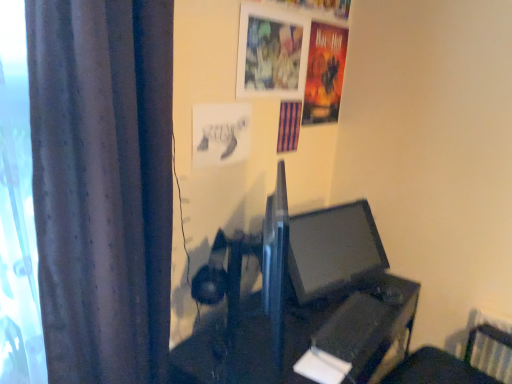
Question: Does dark grey fabric curtain at left have a smaller size compared to purple striped poster at upper center, which ranks as the 2th poster page in back-to-front order?

Choices:
 (A) yes
 (B) no

Answer: (B)

Question: Is dark grey fabric curtain at left touching purple striped poster at upper center, placed as the 2th poster page when sorted from right to left?

Choices:
 (A) yes
 (B) no

Answer: (B)

Question: Does dark grey fabric curtain at left come behind purple striped poster at upper center, marked as the second poster page in a front-to-back arrangement?

Choices:
 (A) yes
 (B) no

Answer: (B)

Question: Is dark grey fabric curtain at left not within purple striped poster at upper center, marked as the second poster page in a front-to-back arrangement?

Choices:
 (A) yes
 (B) no

Answer: (A)

Question: From a real-world perspective, is dark grey fabric curtain at left located beneath purple striped poster at upper center, marked as the second poster page in a front-to-back arrangement?

Choices:
 (A) yes
 (B) no

Answer: (A)

Question: Is point (254, 4) closer or farther from the camera than point (212, 137)?

Choices:
 (A) farther
 (B) closer

Answer: (A)

Question: Considering the positions of metallic silver picture frame at upper center and white paper at upper center, acting as the 3th poster page starting from the right, in the image, is metallic silver picture frame at upper center wider or thinner than white paper at upper center, acting as the 3th poster page starting from the right,?

Choices:
 (A) wide
 (B) thin

Answer: (A)

Question: From a real-world perspective, is metallic silver picture frame at upper center positioned above or below white paper at upper center, the first poster page positioned from the front?

Choices:
 (A) below
 (B) above

Answer: (B)

Question: Choose the correct answer: Is metallic silver picture frame at upper center inside white paper at upper center, acting as the 3th poster page starting from the right, or outside it?

Choices:
 (A) outside
 (B) inside

Answer: (A)

Question: From a real-world perspective, relative to white paper at upper center, acting as the 3th poster page starting from the right, is matte black monitor at center vertically above or below?

Choices:
 (A) above
 (B) below

Answer: (B)

Question: Based on their sizes in the image, would you say matte black monitor at center is bigger or smaller than white paper at upper center, which ranks as the 1th poster page in left-to-right order?

Choices:
 (A) small
 (B) big

Answer: (B)

Question: Is matte black monitor at center spatially inside white paper at upper center, acting as the 3th poster page starting from the right, or outside of it?

Choices:
 (A) inside
 (B) outside

Answer: (B)

Question: Would you say matte black monitor at center is to the left or to the right of white paper at upper center, placed as the 3th poster page when sorted from back to front, in the picture?

Choices:
 (A) right
 (B) left

Answer: (A)

Question: Is black plastic table at center wider or thinner than white paper at upper center, the first poster page positioned from the front?

Choices:
 (A) thin
 (B) wide

Answer: (B)

Question: Is black plastic table at center to the left or to the right of white paper at upper center, which ranks as the 1th poster page in left-to-right order, in the image?

Choices:
 (A) left
 (B) right

Answer: (B)